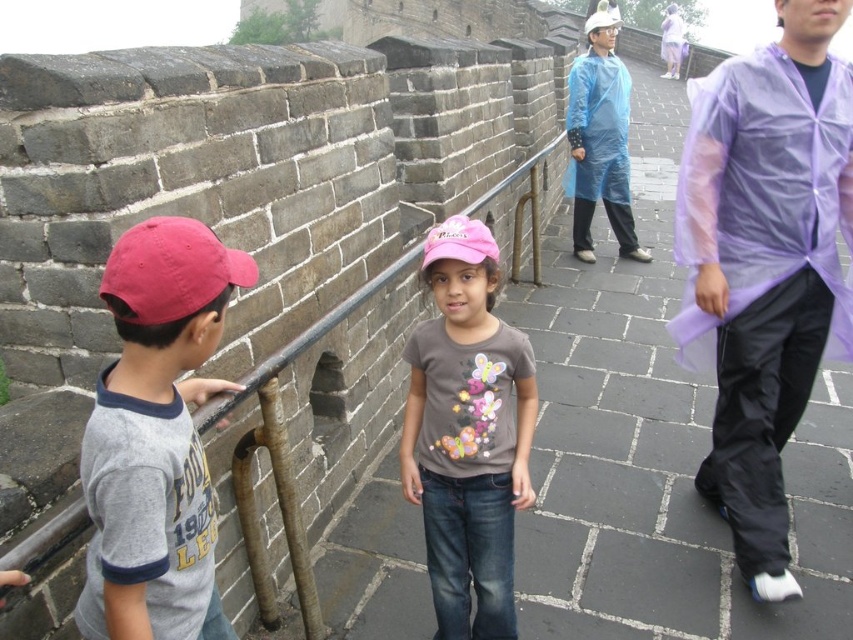
Does transparent purple raincoat at right have a smaller size compared to blue transparent raincoat at upper center?

No, transparent purple raincoat at right is not smaller than blue transparent raincoat at upper center.

Locate an element on the screen. transparent purple raincoat at right is located at coordinates (764, 262).

Identify the location of transparent purple raincoat at right. (764, 262).

Between point (721, 250) and point (529, 499), which one is positioned behind?

Point (721, 250)

Which is in front, point (793, 349) or point (461, 241)?

Point (461, 241)

Is point (834, 157) less distant than point (486, 598)?

No, it is behind (486, 598).

You are a GUI agent. You are given a task and a screenshot of the screen. Output one action in this format:
    pyautogui.click(x=<x>, y=<y>)
    Task: Click on the transparent purple raincoat at right
    The width and height of the screenshot is (853, 640).
    Given the screenshot: What is the action you would take?
    pyautogui.click(x=764, y=262)

Is brushed metal rail at center positioned at the back of blue transparent raincoat at upper center?

No, it is in front of blue transparent raincoat at upper center.

Which of these two, brushed metal rail at center or blue transparent raincoat at upper center, stands shorter?

blue transparent raincoat at upper center is shorter.

Does point (207, 419) come behind point (637, 250)?

No.

Find the location of a particular element. This screenshot has width=853, height=640. brushed metal rail at center is located at coordinates (282, 458).